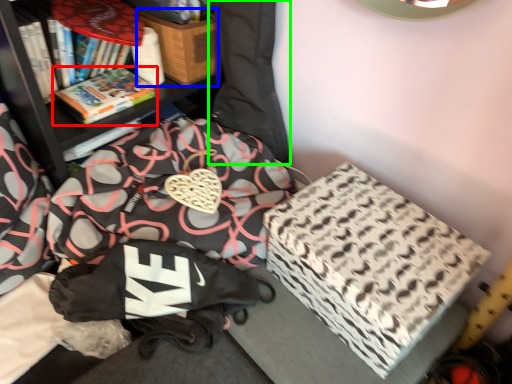
Question: Estimate the real-world distances between objects in this image. Which object is farther from book (highlighted by a red box), cardboard box (highlighted by a blue box) or bean bag chair (highlighted by a green box)?

Choices:
 (A) cardboard box
 (B) bean bag chair

Answer: (B)